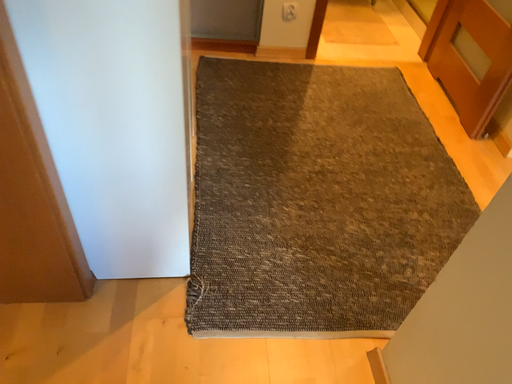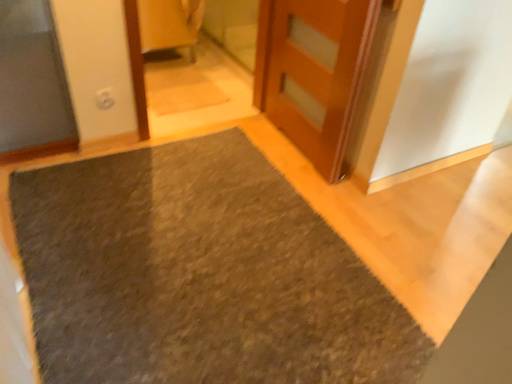
Question: Which way did the camera rotate in the video?

Choices:
 (A) rotated upward
 (B) rotated downward

Answer: (A)